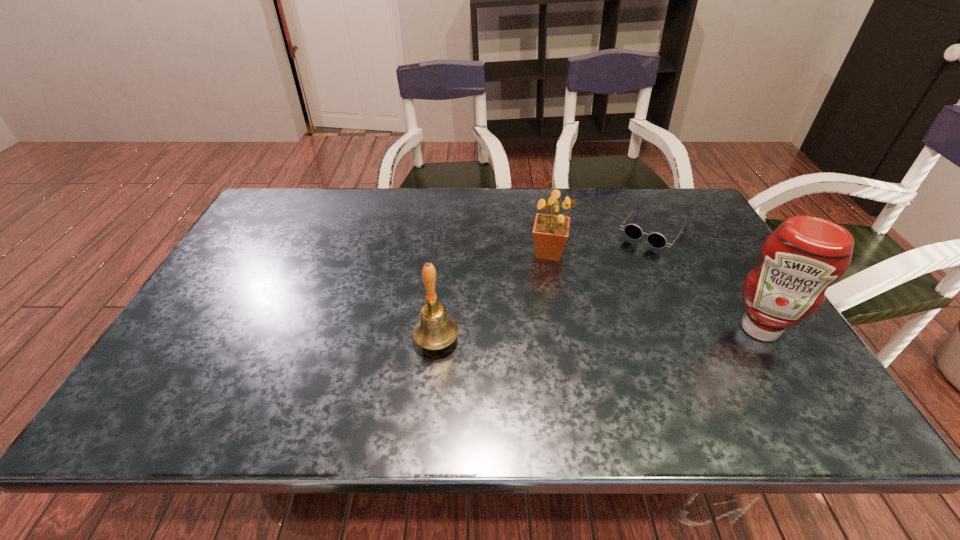
Where is `free space at the far left corner of the desktop`? The width and height of the screenshot is (960, 540). free space at the far left corner of the desktop is located at coordinates (295, 192).

This screenshot has width=960, height=540. I want to click on free region at the near right corner, so click(x=791, y=384).

Find the location of a particular element. This screenshot has height=540, width=960. empty space between the sunglasses and the sunflower is located at coordinates (601, 242).

Find the location of a particular element. The width and height of the screenshot is (960, 540). empty space that is in between the shortest object and the condiment is located at coordinates (706, 280).

Locate an element on the screen. This screenshot has height=540, width=960. free spot between the shortest object and the condiment is located at coordinates (706, 280).

Identify the location of unoccupied area between the condiment and the sunflower. The height and width of the screenshot is (540, 960). (655, 291).

Locate an element on the screen. vacant point located between the sunglasses and the sunflower is located at coordinates (601, 242).

Find the location of a particular element. The width and height of the screenshot is (960, 540). vacant area between the tallest object and the shortest object is located at coordinates (706, 280).

The height and width of the screenshot is (540, 960). Identify the location of free spot between the second object from left to right and the shortest object. click(601, 242).

Identify the location of free spot between the shortest object and the leftmost object. The width and height of the screenshot is (960, 540). (544, 285).